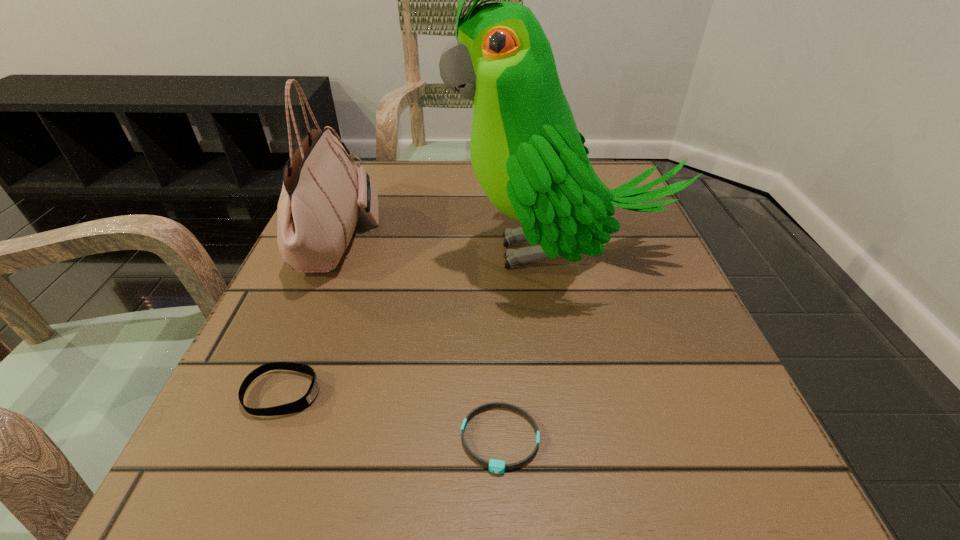
The height and width of the screenshot is (540, 960). I want to click on vacant space located 0.050m on the display of the second shortest object, so click(355, 393).

At what (x,y) coordinates should I click in order to perform the action: click on free spot located on the buckle of the right wristband. Please return your answer as a coordinate pair (x, y). Looking at the image, I should click on (503, 521).

Locate an element on the screen. Image resolution: width=960 pixels, height=540 pixels. parakeet situated at the far edge is located at coordinates (530, 159).

This screenshot has width=960, height=540. Find the location of `handbag that is positioned at the far edge`. handbag that is positioned at the far edge is located at coordinates (322, 194).

What are the coordinates of `object at the near edge` in the screenshot? It's located at (495, 466).

This screenshot has height=540, width=960. I want to click on handbag located in the left edge section of the desktop, so click(322, 194).

Image resolution: width=960 pixels, height=540 pixels. Identify the location of wristband at the left edge. (301, 404).

Where is `object situated at the right edge`? object situated at the right edge is located at coordinates (530, 159).

Identify the location of object present at the far left corner. The height and width of the screenshot is (540, 960). (322, 194).

I want to click on object situated at the far right corner, so click(x=530, y=159).